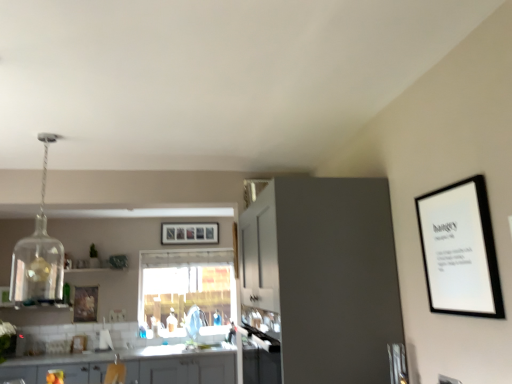
This screenshot has height=384, width=512. In order to click on matte yellow drawer at lower left in this screenshot , I will do `click(66, 373)`.

This screenshot has height=384, width=512. What are the coordinates of `transparent glass window at center` in the screenshot? It's located at (186, 290).

I want to click on white matte picture frame at upper right, arranged as the 1th picture frame when viewed from the front, so pyautogui.click(x=460, y=250).

What do you see at coordinates (324, 276) in the screenshot? I see `matte gray cabinet at center, which is the first cabinetry in right-to-left order` at bounding box center [324, 276].

The image size is (512, 384). Identify the location of matte white picture frame at center, acting as the 2th picture frame starting from the right. (189, 233).

This screenshot has height=384, width=512. Identify the location of clear glass pendant at upper left. (38, 255).

I want to click on matte gray cabinets at lower left, which ranks as the first cabinetry in left-to-right order, so click(179, 366).

Locate an element on the screen. The height and width of the screenshot is (384, 512). matte yellow drawer at lower left is located at coordinates (66, 373).

How far apart are white matte picture frame at upper right, placed as the third picture frame when sorted from back to front, and matte white picture frame at center, arranged as the 1th picture frame when viewed from the back?

white matte picture frame at upper right, placed as the third picture frame when sorted from back to front, is 4.97 meters from matte white picture frame at center, arranged as the 1th picture frame when viewed from the back.

Is point (451, 281) farther from viewer compared to point (196, 223)?

No, it is in front of (196, 223).

Is white matte picture frame at upper right, placed as the third picture frame when sorted from back to front, directly adjacent to matte white picture frame at center, the 3th picture frame from the front?

No, white matte picture frame at upper right, placed as the third picture frame when sorted from back to front, is not making contact with matte white picture frame at center, the 3th picture frame from the front.

Between white matte picture frame at upper right, placed as the third picture frame when sorted from back to front, and matte white picture frame at center, arranged as the second picture frame when ordered from the bottom, which one appears on the right side from the viewer's perspective?

white matte picture frame at upper right, placed as the third picture frame when sorted from back to front.

Does wooden picture frame at left, the first picture frame in the left-to-right sequence, appear on the left side of matte white picture frame at center, arranged as the second picture frame when ordered from the bottom?

Correct, you'll find wooden picture frame at left, the first picture frame in the left-to-right sequence, to the left of matte white picture frame at center, arranged as the second picture frame when ordered from the bottom.

From a real-world perspective, is wooden picture frame at left, which appears as the second picture frame when viewed from the back, below matte white picture frame at center, arranged as the second picture frame when ordered from the bottom?

Correct, in the physical world, wooden picture frame at left, which appears as the second picture frame when viewed from the back, is lower than matte white picture frame at center, arranged as the second picture frame when ordered from the bottom.

Considering their positions, is wooden picture frame at left, the first picture frame in the left-to-right sequence, located in front of or behind matte white picture frame at center, the 3th picture frame from the front?

Visually, wooden picture frame at left, the first picture frame in the left-to-right sequence, is located in front of matte white picture frame at center, the 3th picture frame from the front.

What's the angular difference between wooden picture frame at left, positioned as the 2th picture frame in front-to-back order, and matte white picture frame at center, the 3th picture frame from the front,'s facing directions?

There is a 0.54-degree angle between the facing directions of wooden picture frame at left, positioned as the 2th picture frame in front-to-back order, and matte white picture frame at center, the 3th picture frame from the front.

Could you tell me if matte gray cabinets at lower left, marked as the 1th cabinetry in a bottom-to-top arrangement, is turned towards transparent glass window at center?

No.

Based on the photo, considering the sizes of objects matte gray cabinets at lower left, which ranks as the first cabinetry in left-to-right order, and transparent glass window at center in the image provided, who is taller, matte gray cabinets at lower left, which ranks as the first cabinetry in left-to-right order, or transparent glass window at center?

Standing taller between the two is transparent glass window at center.

Is point (103, 368) farther from camera compared to point (145, 309)?

No, (103, 368) is in front of (145, 309).

From the image's perspective, is matte gray cabinets at lower left, marked as the 1th cabinetry in a bottom-to-top arrangement, over transparent glass window at center?

No, from the image's perspective, matte gray cabinets at lower left, marked as the 1th cabinetry in a bottom-to-top arrangement, is not on top of transparent glass window at center.

From the image's perspective, which one is positioned higher, matte yellow drawer at lower left or matte gray cabinet at center, placed as the 1th cabinetry when sorted from front to back?

matte gray cabinet at center, placed as the 1th cabinetry when sorted from front to back, appears higher in the image.

Are matte yellow drawer at lower left and matte gray cabinet at center, placed as the 1th cabinetry when sorted from front to back, beside each other?

No, matte yellow drawer at lower left is not with matte gray cabinet at center, placed as the 1th cabinetry when sorted from front to back.

Can you confirm if matte yellow drawer at lower left is wider than matte gray cabinet at center, which is the first cabinetry in right-to-left order?

In fact, matte yellow drawer at lower left might be narrower than matte gray cabinet at center, which is the first cabinetry in right-to-left order.

Does point (66, 365) come behind point (267, 270)?

Yes, point (66, 365) is behind point (267, 270).

Does matte gray cabinet at center, which is the second cabinetry in back-to-front order, have a smaller size compared to white matte picture frame at upper right, marked as the 1th picture frame in a top-to-bottom arrangement?

Actually, matte gray cabinet at center, which is the second cabinetry in back-to-front order, might be larger than white matte picture frame at upper right, marked as the 1th picture frame in a top-to-bottom arrangement.

From the image's perspective, starting from the matte gray cabinet at center, which is the first cabinetry in right-to-left order, which picture frame is the 2nd one above? Please provide its 2D coordinates.

[(460, 250)]

Considering the relative sizes of matte gray cabinet at center, which is the second cabinetry in back-to-front order, and white matte picture frame at upper right, marked as the 1th picture frame in a top-to-bottom arrangement, in the image provided, is matte gray cabinet at center, which is the second cabinetry in back-to-front order, wider than white matte picture frame at upper right, marked as the 1th picture frame in a top-to-bottom arrangement,?

Yes.

Is matte gray cabinet at center, placed as the 1th cabinetry when sorted from front to back, aimed at white matte picture frame at upper right, the third picture frame in the bottom-to-top sequence?

No, matte gray cabinet at center, placed as the 1th cabinetry when sorted from front to back, is not facing towards white matte picture frame at upper right, the third picture frame in the bottom-to-top sequence.

Is wooden picture frame at left, positioned as the 2th picture frame in front-to-back order, positioned before matte gray cabinets at lower left, the 2th cabinetry viewed from the right?

No, it is behind matte gray cabinets at lower left, the 2th cabinetry viewed from the right.

Between point (88, 314) and point (12, 374), which one is positioned in front?

Point (12, 374)

From their relative heights in the image, would you say wooden picture frame at left, which is the first picture frame from bottom to top, is taller or shorter than matte gray cabinets at lower left, the 2th cabinetry when ordered from top to bottom?

In the image, wooden picture frame at left, which is the first picture frame from bottom to top, appears to be shorter than matte gray cabinets at lower left, the 2th cabinetry when ordered from top to bottom.

Is matte yellow drawer at lower left not inside clear glass pendant at upper left?

matte yellow drawer at lower left lies outside clear glass pendant at upper left's area.

Considering the relative positions of matte yellow drawer at lower left and clear glass pendant at upper left in the image provided, is matte yellow drawer at lower left to the right of clear glass pendant at upper left from the viewer's perspective?

Correct, you'll find matte yellow drawer at lower left to the right of clear glass pendant at upper left.

Could you tell me if matte yellow drawer at lower left is facing clear glass pendant at upper left?

No, matte yellow drawer at lower left is not oriented towards clear glass pendant at upper left.

Considering the sizes of objects matte yellow drawer at lower left and clear glass pendant at upper left in the image provided, who is shorter, matte yellow drawer at lower left or clear glass pendant at upper left?

Standing shorter between the two is matte yellow drawer at lower left.

Identify the location of picture frame that is above the matte white picture frame at center, the 3th picture frame from the front (from the image's perspective). (460, 250).

Locate an element on the screen. The width and height of the screenshot is (512, 384). picture frame that is the 1st object located in front of the matte white picture frame at center, arranged as the 1th picture frame when viewed from the back is located at coordinates (85, 304).

Looking at the image, which one is located closer to matte gray cabinet at center, which is the first cabinetry from top to bottom, transparent glass window at center or wooden picture frame at left, marked as the third picture frame in a top-to-bottom arrangement?

transparent glass window at center is closer to matte gray cabinet at center, which is the first cabinetry from top to bottom.

Looking at the image, which one is located further to transparent glass window at center, clear glass pendant at upper left or matte gray cabinet at center, placed as the 1th cabinetry when sorted from front to back?

matte gray cabinet at center, placed as the 1th cabinetry when sorted from front to back, is positioned further to the anchor transparent glass window at center.

Considering their positions, is matte gray cabinets at lower left, the 2th cabinetry positioned from the front, positioned closer to transparent glass window at center than matte gray cabinet at center, which is the first cabinetry in right-to-left order?

Among the two, matte gray cabinets at lower left, the 2th cabinetry positioned from the front, is located nearer to transparent glass window at center.

Estimate the real-world distances between objects in this image. Which object is further from white matte picture frame at upper right, arranged as the 1th picture frame when viewed from the front, transparent glass window at center or wooden picture frame at left, which appears as the second picture frame when viewed from the back?

wooden picture frame at left, which appears as the second picture frame when viewed from the back, lies further to white matte picture frame at upper right, arranged as the 1th picture frame when viewed from the front, than the other object.

Which object lies nearer to the anchor point matte white picture frame at center, arranged as the second picture frame when ordered from the bottom, white matte picture frame at upper right, arranged as the 1th picture frame when viewed from the front, or clear glass pendant at upper left?

The object closer to matte white picture frame at center, arranged as the second picture frame when ordered from the bottom, is clear glass pendant at upper left.

Considering their positions, is matte gray cabinet at center, which is the first cabinetry in right-to-left order, positioned further to transparent glass window at center than clear glass pendant at upper left?

Among the two, matte gray cabinet at center, which is the first cabinetry in right-to-left order, is located further to transparent glass window at center.

Looking at this image, which object lies nearer to the anchor point transparent glass window at center, white matte picture frame at upper right, the third picture frame viewed from the left, or wooden picture frame at left, the 3th picture frame in the right-to-left sequence?

wooden picture frame at left, the 3th picture frame in the right-to-left sequence.

When comparing their distances from transparent glass window at center, does matte white picture frame at center, the second picture frame viewed from the top, or matte gray cabinet at center, which is the second cabinetry in back-to-front order, seem further?

matte gray cabinet at center, which is the second cabinetry in back-to-front order, lies further to transparent glass window at center than the other object.

This screenshot has width=512, height=384. Find the location of `drawer between white matte picture frame at upper right, marked as the 1th picture frame in a top-to-bottom arrangement, and matte gray cabinets at lower left, which ranks as the first cabinetry in back-to-front order, along the z-axis`. drawer between white matte picture frame at upper right, marked as the 1th picture frame in a top-to-bottom arrangement, and matte gray cabinets at lower left, which ranks as the first cabinetry in back-to-front order, along the z-axis is located at coordinates (66, 373).

I want to click on drawer between white matte picture frame at upper right, marked as the 1th picture frame in a top-to-bottom arrangement, and matte white picture frame at center, which is the 2th picture frame in left-to-right order, in the front-back direction, so click(66, 373).

Image resolution: width=512 pixels, height=384 pixels. Identify the location of picture frame between white matte picture frame at upper right, placed as the third picture frame when sorted from back to front, and transparent glass window at center, along the z-axis. (85, 304).

Find the location of a particular element. The image size is (512, 384). cabinetry positioned between matte yellow drawer at lower left and transparent glass window at center from near to far is located at coordinates (179, 366).